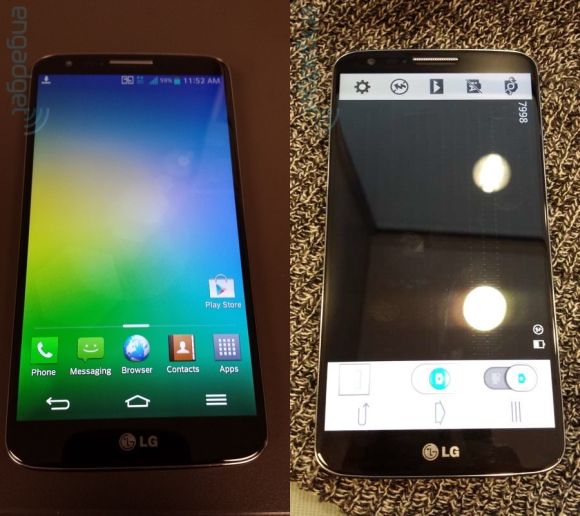
I want to click on floor under carpet or rug, so click(x=304, y=506).